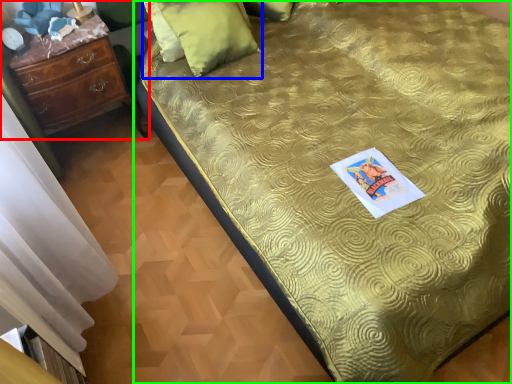
Question: Estimate the real-world distances between objects in this image. Which object is farther from chest of drawers (highlighted by a red box), pillow (highlighted by a blue box) or bed (highlighted by a green box)?

Choices:
 (A) pillow
 (B) bed

Answer: (B)